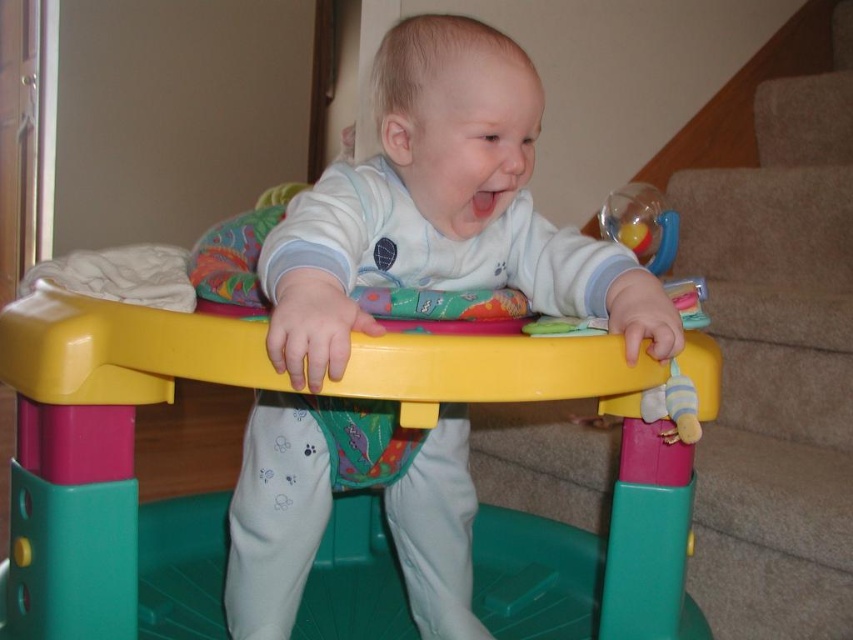
You are a parent trying to choose between the white soft baby walker at center and the plastic walker at center for your child. Based on the size, which one might be more suitable for a younger infant?

The white soft baby walker at center is smaller than plastic walker at center, so it might be more suitable for a younger infant due to its smaller size.

You are a parent trying to place a toy on the floor near the plastic walker at center. If you want the toy to be as close as possible to the walker without being on it, where should you place it?

The toy should be placed near the plastic walker at center but not on it, ideally close to its base or sides where it won not interfere with the walker itself.